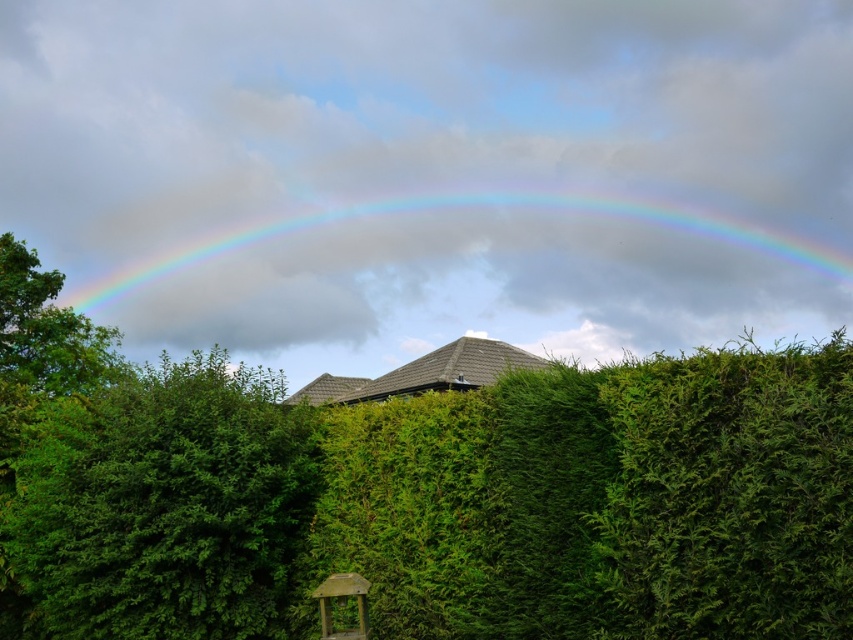
You are standing at the wooden gazebo at lower center and want to see the rainbow. Can you see the rainbow through the green leafy bush at left?

The green leafy bush at left is positioned over the wooden gazebo at lower center, so it might block your view of the rainbow unless you move to a position where the bush is not obstructing the sky.

You are standing in the garden looking at the rainbow and the hedge. There is a point marked at coordinates (164, 504). What object does this point correspond to?

The point at coordinates (164, 504) corresponds to the green leafy bush at left.

You are standing at the point closest to the viewer between the two points, point (59, 438) and point (323, 584). Which point are you standing at?

You are standing at point (59, 438) because it is closer to the viewer than point (323, 584).